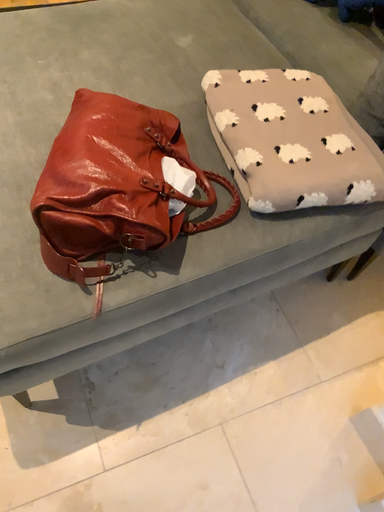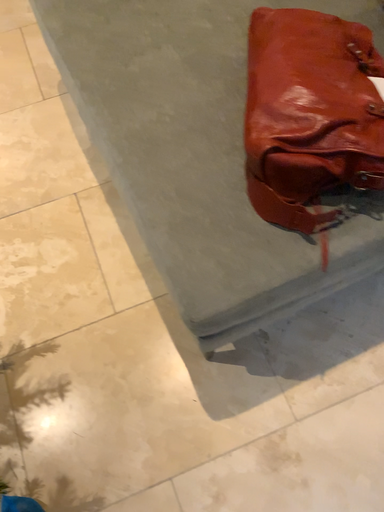
Question: How did the camera likely rotate when shooting the video?

Choices:
 (A) rotated upward
 (B) rotated downward

Answer: (B)